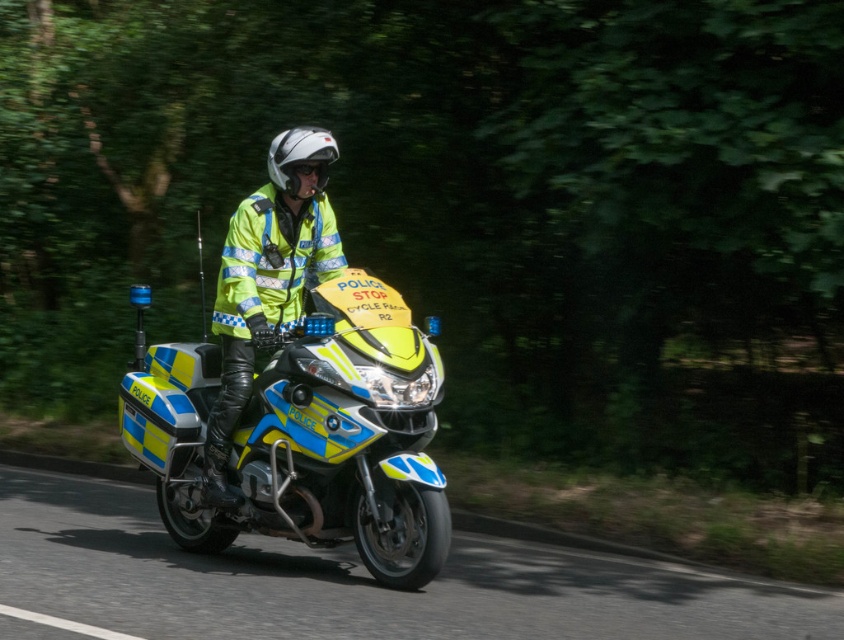
Does blue and yellow plastic motorcycle at center have a greater height compared to white matte helmet at center?

Correct, blue and yellow plastic motorcycle at center is much taller as white matte helmet at center.

Who is positioned more to the right, blue and yellow plastic motorcycle at center or white matte helmet at center?

white matte helmet at center is more to the right.

Identify the location of blue and yellow plastic motorcycle at center. (307, 435).

What do you see at coordinates (307, 435) in the screenshot? Image resolution: width=844 pixels, height=640 pixels. I see `blue and yellow plastic motorcycle at center` at bounding box center [307, 435].

Between blue and yellow plastic motorcycle at center and high-visibility reflective jacket at center, which one appears on the left side from the viewer's perspective?

Positioned to the left is blue and yellow plastic motorcycle at center.

Between point (333, 420) and point (203, 502), which one is positioned behind?

The point (203, 502) is behind.

Locate an element on the screen. The width and height of the screenshot is (844, 640). blue and yellow plastic motorcycle at center is located at coordinates (307, 435).

Consider the image. Does high-visibility reflective jacket at center appear under white matte helmet at center?

Correct, high-visibility reflective jacket at center is located below white matte helmet at center.

Can you confirm if high-visibility reflective jacket at center is bigger than white matte helmet at center?

Indeed, high-visibility reflective jacket at center has a larger size compared to white matte helmet at center.

The height and width of the screenshot is (640, 844). Find the location of `high-visibility reflective jacket at center`. high-visibility reflective jacket at center is located at coordinates (268, 280).

Identify the location of high-visibility reflective jacket at center. (268, 280).